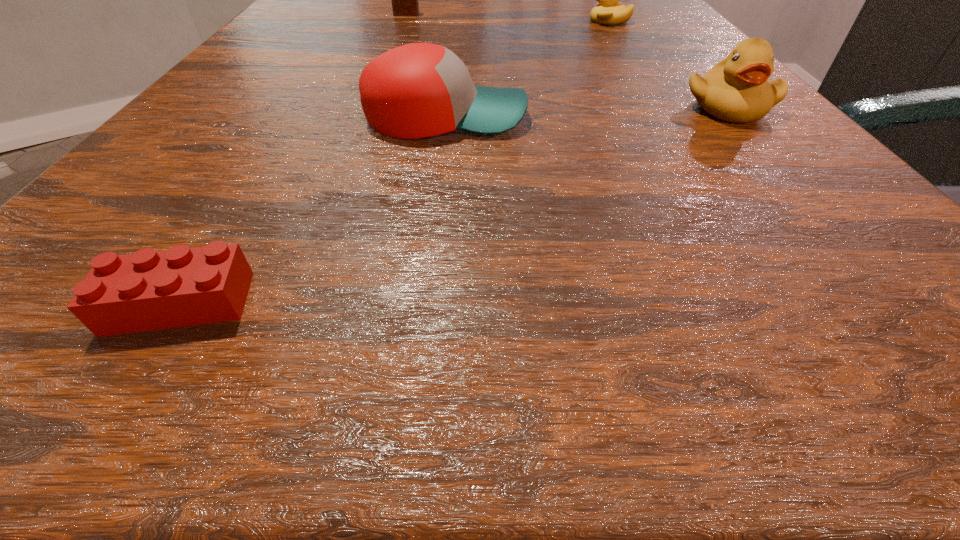
Where is `free space located 0.170m on the front-facing side of the farther duckling`? The width and height of the screenshot is (960, 540). free space located 0.170m on the front-facing side of the farther duckling is located at coordinates (504, 21).

This screenshot has width=960, height=540. What are the coordinates of `free region located on the front-facing side of the farther duckling` in the screenshot? It's located at (464, 21).

The height and width of the screenshot is (540, 960). Find the location of `free spot located on the front-facing side of the farther duckling`. free spot located on the front-facing side of the farther duckling is located at coordinates (535, 21).

Identify the location of vacant space located 0.400m on the right of the leftmost object. Image resolution: width=960 pixels, height=540 pixels. (735, 303).

The width and height of the screenshot is (960, 540). Find the location of `padlock present at the far edge`. padlock present at the far edge is located at coordinates (405, 0).

Where is `duckling present at the far edge`? Image resolution: width=960 pixels, height=540 pixels. duckling present at the far edge is located at coordinates (610, 11).

Find the location of a particular element. This screenshot has width=960, height=540. object located in the near edge section of the desktop is located at coordinates (149, 290).

The width and height of the screenshot is (960, 540). I want to click on object located in the left edge section of the desktop, so click(x=149, y=290).

You are a GUI agent. You are given a task and a screenshot of the screen. Output one action in this format:
    pyautogui.click(x=<x>, y=<y>)
    Task: Click on the object at the near left corner
    
    Given the screenshot: What is the action you would take?
    pyautogui.click(x=149, y=290)

Where is `object located at the far right corner`? The width and height of the screenshot is (960, 540). object located at the far right corner is located at coordinates (610, 11).